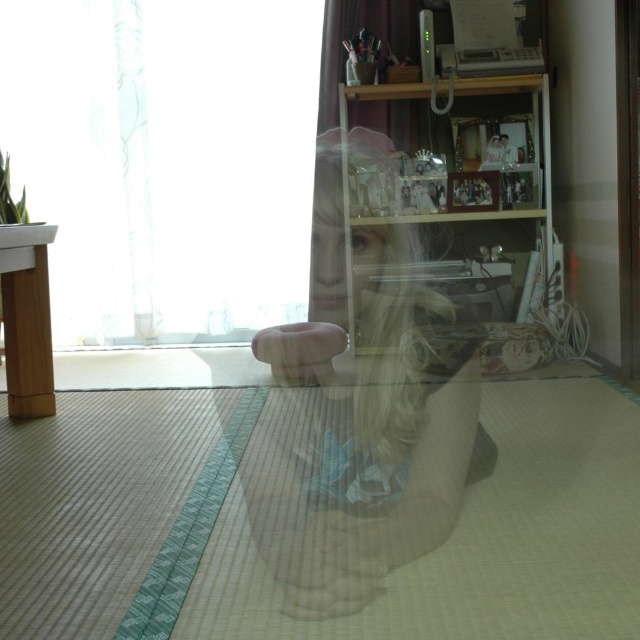
Locate an element on the screen. This screenshot has height=640, width=640. transparent glass door at right is located at coordinates (627, 180).

Does transparent glass door at right have a greater height compared to transparent glass shelf at upper center?

Indeed, transparent glass door at right has a greater height compared to transparent glass shelf at upper center.

Does point (627, 141) lie in front of point (346, 202)?

Yes, point (627, 141) is closer to viewer.

Locate an element on the screen. This screenshot has height=640, width=640. transparent glass door at right is located at coordinates 627,180.

Who is more forward, (161,570) or (424,88)?

Point (161,570) is in front.

Is green bamboo mat at lower center below transparent glass shelf at upper center?

Yes.

Locate an element on the screen. The width and height of the screenshot is (640, 640). green bamboo mat at lower center is located at coordinates (189, 532).

Which is more to the right, blonde hair at center or transparent glass shelf at upper center?

Positioned to the right is transparent glass shelf at upper center.

Which is below, blonde hair at center or transparent glass shelf at upper center?

blonde hair at center is below.

Between point (324, 292) and point (548, 230), which one is positioned in front?

Point (548, 230) is in front.

I want to click on blonde hair at center, so click(x=362, y=419).